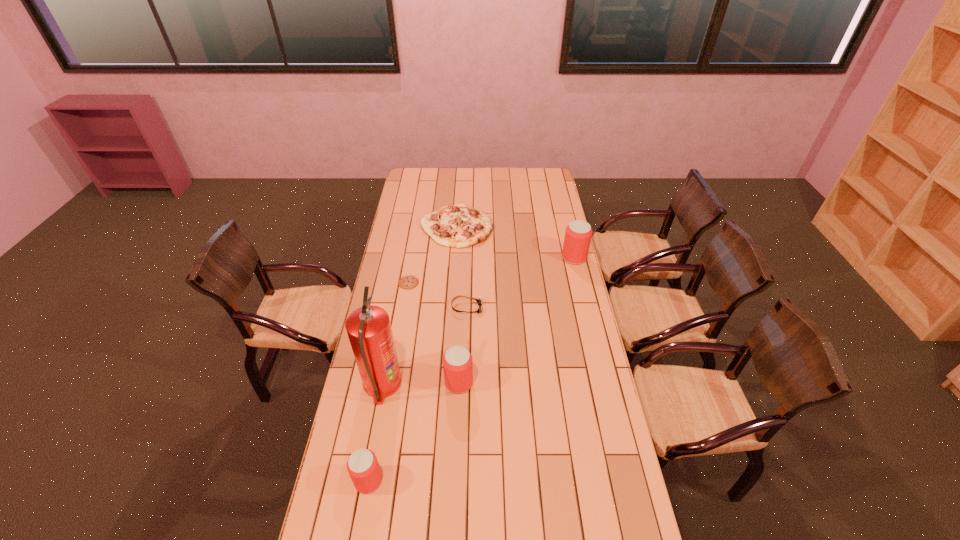
If equal spacing is desired by inserting an extra beer_can among them, please point out a free spot for this new beer_can. Please provide its 2D coordinates. Your answer should be formatted as a tuple, i.e. [(x, y)], where the tuple contains the x and y coordinates of a point satisfying the conditions above.

[(524, 312)]